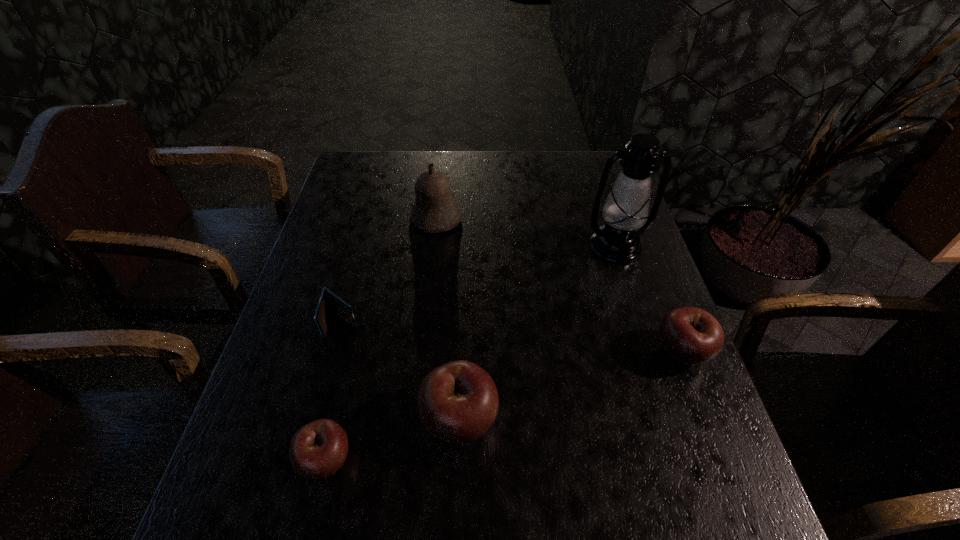
If equal spacing is desired by inserting an extra apple among them, please point out a free spot for this new apple. Please provide its 2D coordinates. Your answer should be formatted as a tuple, i.e. [(x, y)], where the tuple contains the x and y coordinates of a point satisfying the conditions above.

[(577, 383)]